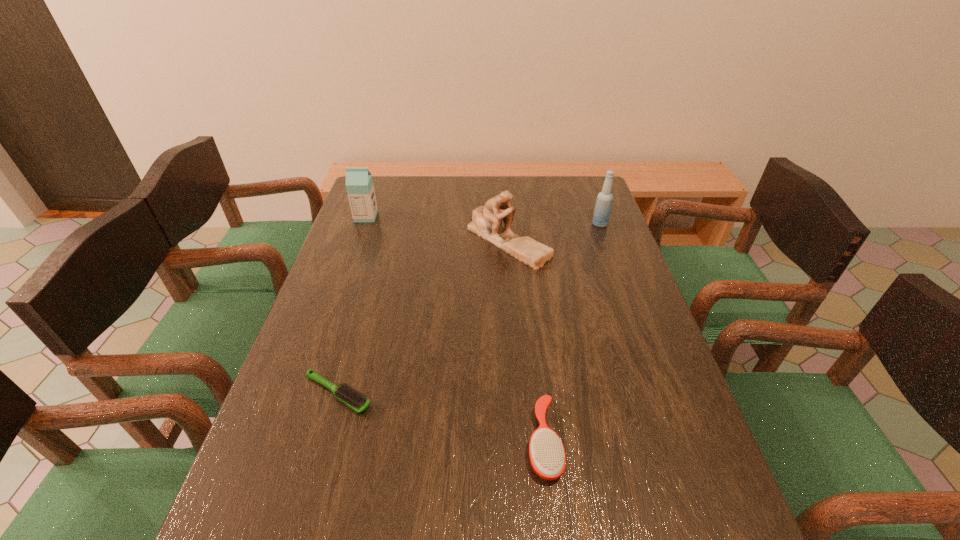
The width and height of the screenshot is (960, 540). In order to click on free area in between the figurine and the bottle in this screenshot , I will do `click(554, 233)`.

Locate an element on the screen. This screenshot has height=540, width=960. vacant space in between the left hairbrush and the rightmost object is located at coordinates (468, 309).

The height and width of the screenshot is (540, 960). I want to click on vacant area that lies between the figurine and the bottle, so click(x=554, y=233).

The image size is (960, 540). I want to click on unoccupied position between the bottle and the figurine, so click(x=554, y=233).

Where is `unoccupied area between the second shortest object and the figurine`? The width and height of the screenshot is (960, 540). unoccupied area between the second shortest object and the figurine is located at coordinates (526, 341).

The height and width of the screenshot is (540, 960). I want to click on vacant space that is in between the shorter hairbrush and the right hairbrush, so click(441, 417).

The image size is (960, 540). What are the coordinates of `vacant area between the right hairbrush and the rightmost object` in the screenshot? It's located at (572, 333).

You are a GUI agent. You are given a task and a screenshot of the screen. Output one action in this format:
    pyautogui.click(x=<x>, y=<y>)
    Task: Click on the unoccupied area between the figurine and the left hairbrush
    
    Given the screenshot: What is the action you would take?
    pyautogui.click(x=422, y=317)

Locate an element on the screen. The width and height of the screenshot is (960, 540). vacant space that is in between the rightmost object and the figurine is located at coordinates (554, 233).

Find the location of `the closest object relative to the left hairbrush`. the closest object relative to the left hairbrush is located at coordinates (547, 454).